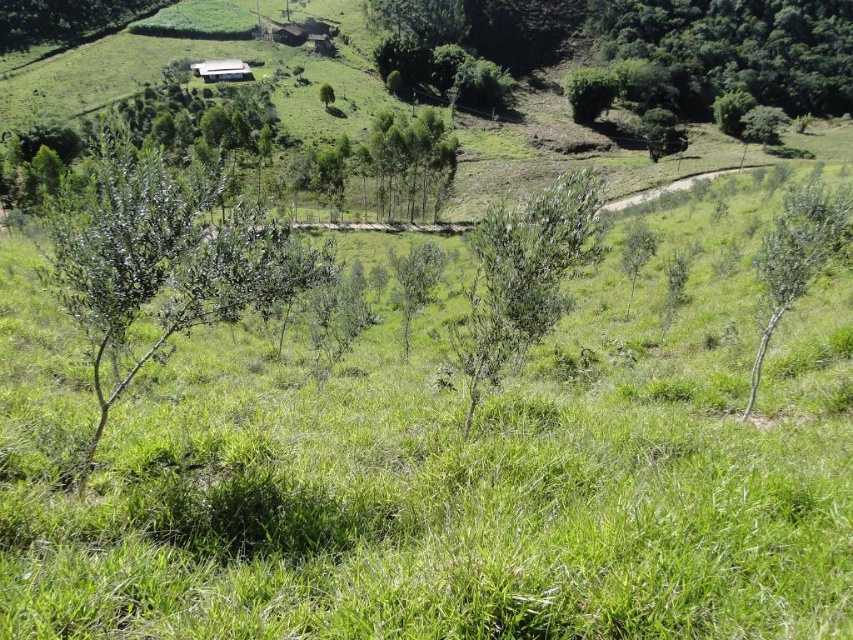
Question: Based on their relative distances, which object is nearer to the green leafy shrub at center?

Choices:
 (A) white corrugated metal hut at upper center
 (B) brown wooden hut at center
 (C) green leafy shrub at left

Answer: (C)

Question: Does green leafy tree at right lie in front of brown wooden hut at center?

Choices:
 (A) yes
 (B) no

Answer: (A)

Question: Which point is closer to the camera?

Choices:
 (A) (270, 32)
 (B) (540, 316)
 (C) (405, 356)

Answer: (B)

Question: Is green leafy shrub at left above green leafy shrub at center?

Choices:
 (A) no
 (B) yes

Answer: (B)

Question: Does green leafy tree at right appear on the left side of brown wooden hut at center?

Choices:
 (A) yes
 (B) no

Answer: (B)

Question: Based on their relative distances, which object is nearer to the white corrugated metal hut at upper center?

Choices:
 (A) brown wooden hut at center
 (B) green leafy shrub at center
 (C) green leafy shrub at left
 (D) green leafy tree at center

Answer: (A)